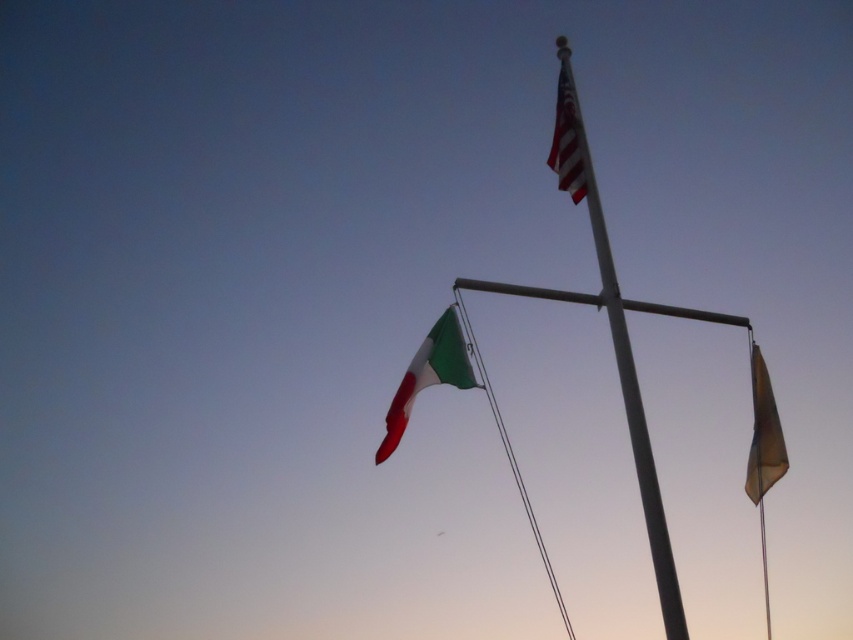
Question: Which point is farther to the camera?

Choices:
 (A) (556, 138)
 (B) (448, 355)
 (C) (647, 506)

Answer: (A)

Question: Is white metallic flag pole at center bigger than white striped fabric flag at upper center?

Choices:
 (A) yes
 (B) no

Answer: (A)

Question: Which object is closer to the camera taking this photo?

Choices:
 (A) white striped fabric flag at upper center
 (B) white metallic flag pole at center
 (C) white metallic mast at center
 (D) green-white-red fabric flag at center

Answer: (C)

Question: Does white metallic flag pole at center have a larger size compared to brown fabric flag at right?

Choices:
 (A) yes
 (B) no

Answer: (A)

Question: Where is white metallic mast at center located in relation to white striped fabric flag at upper center in the image?

Choices:
 (A) above
 (B) below

Answer: (B)

Question: Which point is farther from the camera taking this photo?

Choices:
 (A) (625, 413)
 (B) (595, 211)
 (C) (749, 467)
 (D) (405, 397)

Answer: (A)